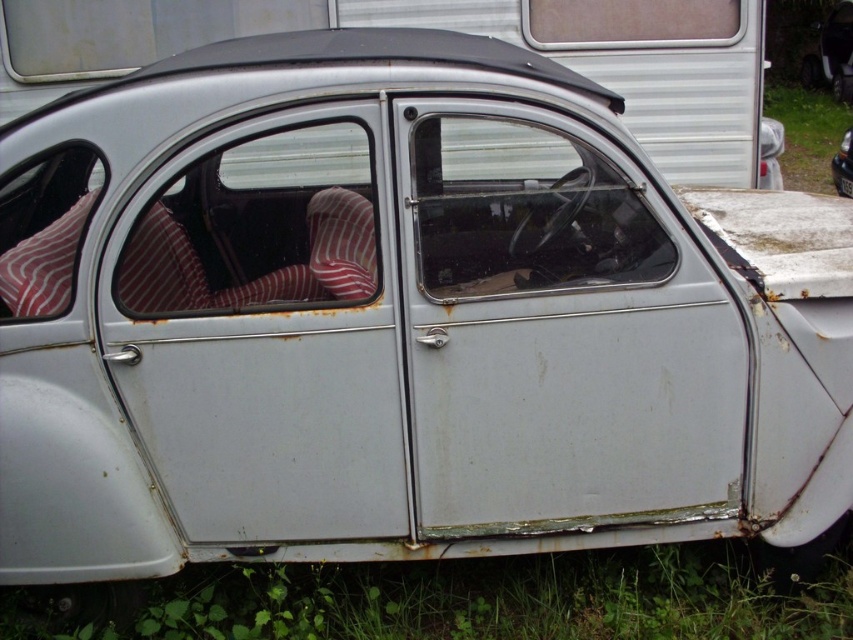
Question: Is green grass at lower center bigger than rusty metal car at center?

Choices:
 (A) yes
 (B) no

Answer: (A)

Question: Which point is closer to the camera?

Choices:
 (A) (461, 576)
 (B) (842, 138)

Answer: (A)

Question: Is green grass at lower center above rusty metal car at center?

Choices:
 (A) no
 (B) yes

Answer: (A)

Question: Which point appears farthest from the camera in this image?

Choices:
 (A) (286, 593)
 (B) (840, 188)

Answer: (B)

Question: Does green grass at lower center lie in front of rusty metal car at center?

Choices:
 (A) yes
 (B) no

Answer: (A)